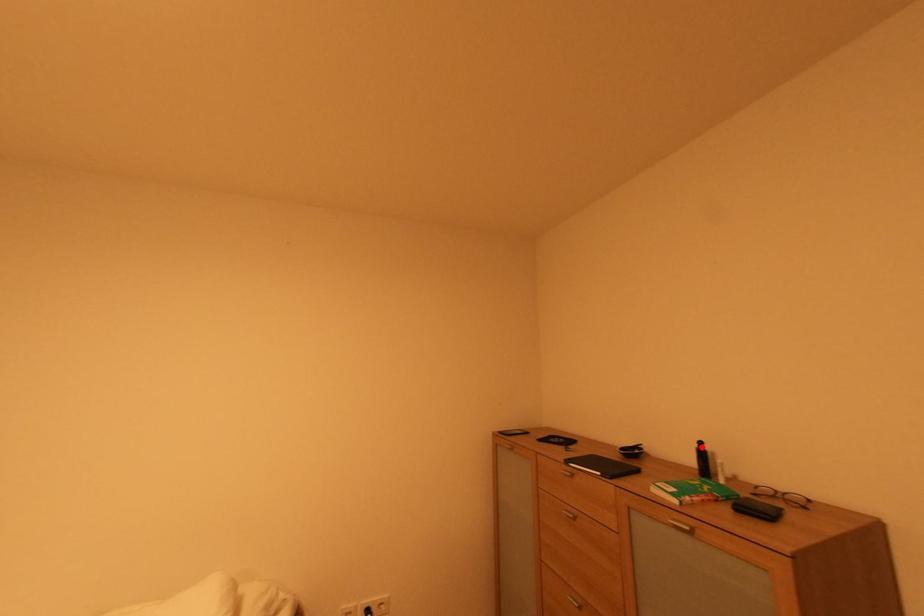
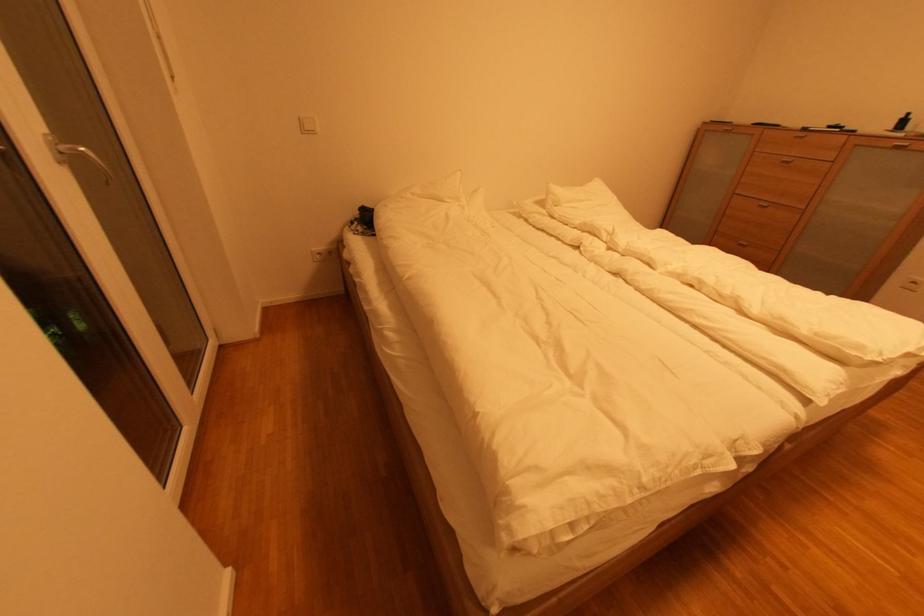
Question: I am providing you with two images of the same scene from different viewpoints. Image1 has a red point marked. In image2, the corresponding 3D location appears at what relative position? Reply with the corresponding letter.

Choices:
 (A) Closer
 (B) Farther

Answer: (B)